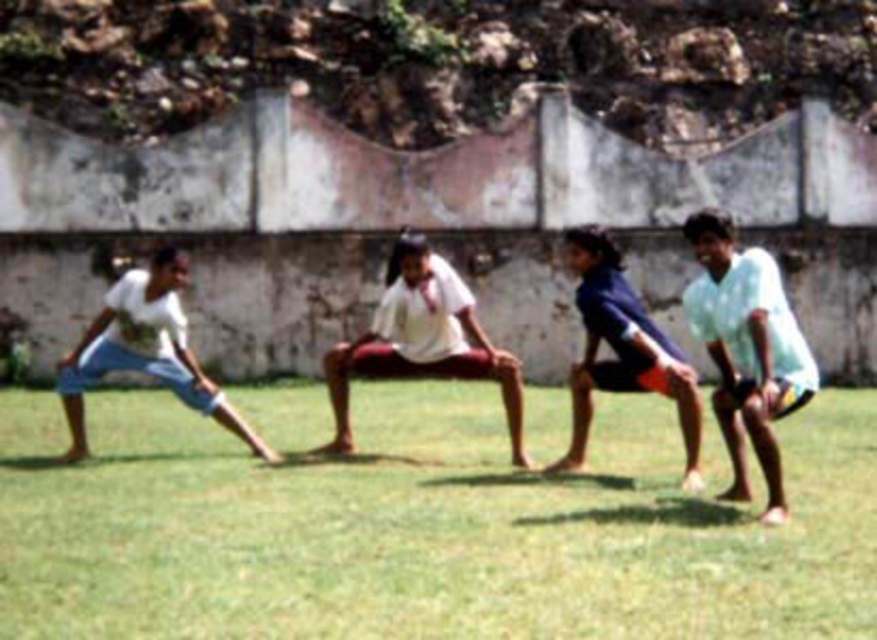
You are standing at point [745,484] and want to walk to point [198,438]. Given the scene, will you be moving towards the wall in the background or away from it?

Point [198,438] is behind point [745,484], so moving from point [745,484] to point [198,438] means you are moving away from the wall in the background.

You are a photographer trying to capture a group photo of the individuals in the scene. You want to ensure that both the white matte shorts at right and the white cotton shorts at left are clearly visible in the frame. Given their size difference, which pair of shorts might you need to adjust your camera angle to better highlight?

The white matte shorts at right has a smaller size compared to the white cotton shorts at left, so you might need to adjust the camera angle to focus more on the white matte shorts at right to ensure it is clearly visible alongside the larger pair.

You are standing at the origin point of the coordinate system. You want to walk to the green grass at center. Which direction should you move in?

Since the green grass at center is located at coordinate point (424, 529), you should move towards the right and forward direction from your current position at the origin to reach it.